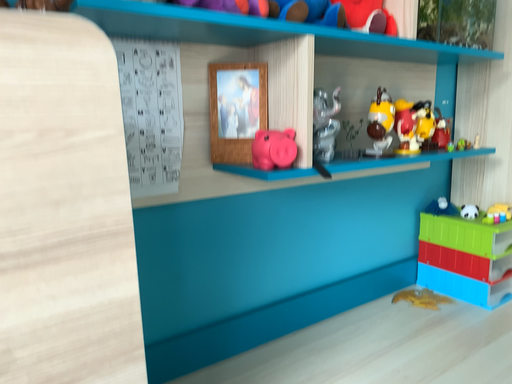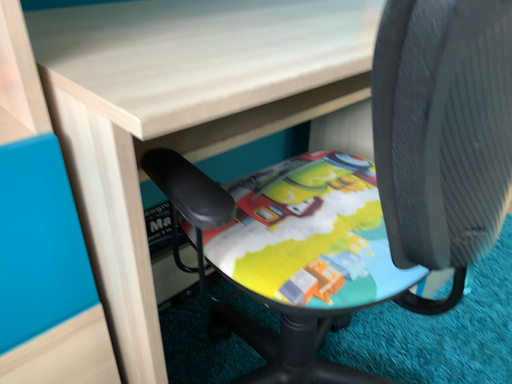
Question: Which way did the camera rotate in the video?

Choices:
 (A) rotated left
 (B) rotated right

Answer: (B)